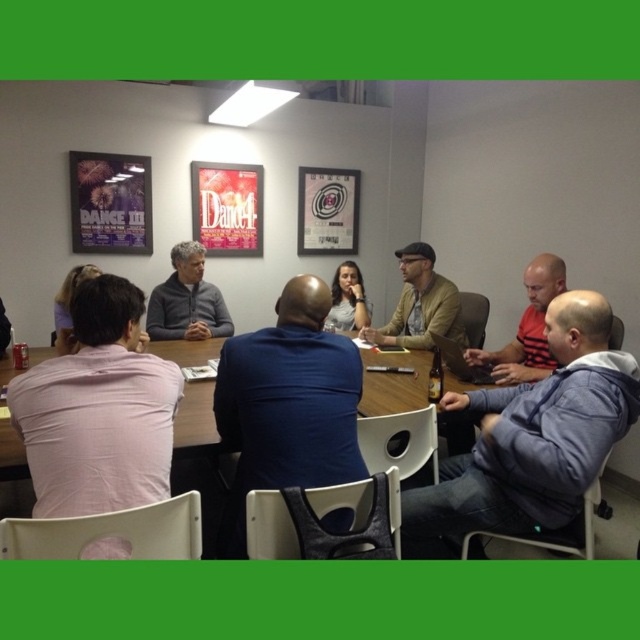
Between pink cotton shirt at left and dark blue sweater at center, which one has more height?

With more height is dark blue sweater at center.

Who is higher up, pink cotton shirt at left or dark blue sweater at center?

pink cotton shirt at left

This screenshot has width=640, height=640. Describe the element at coordinates (99, 410) in the screenshot. I see `pink cotton shirt at left` at that location.

The width and height of the screenshot is (640, 640). What are the coordinates of `pink cotton shirt at left` in the screenshot? It's located at (99, 410).

Find the location of a particular element. This screenshot has width=640, height=640. dark blue sweater at center is located at coordinates (288, 404).

Can you confirm if dark blue sweater at center is positioned above brown leather jacket at center?

Actually, dark blue sweater at center is below brown leather jacket at center.

Where is `dark blue sweater at center`? dark blue sweater at center is located at coordinates (288, 404).

Which is behind, point (584, 481) or point (45, 451)?

The point (584, 481) is behind.

Is blue fleece jacket at lower right to the left of pink cotton shirt at left from the viewer's perspective?

Incorrect, blue fleece jacket at lower right is not on the left side of pink cotton shirt at left.

At what (x,y) coordinates should I click in order to perform the action: click on blue fleece jacket at lower right. Please return your answer as a coordinate pair (x, y). This screenshot has width=640, height=640. Looking at the image, I should click on (531, 438).